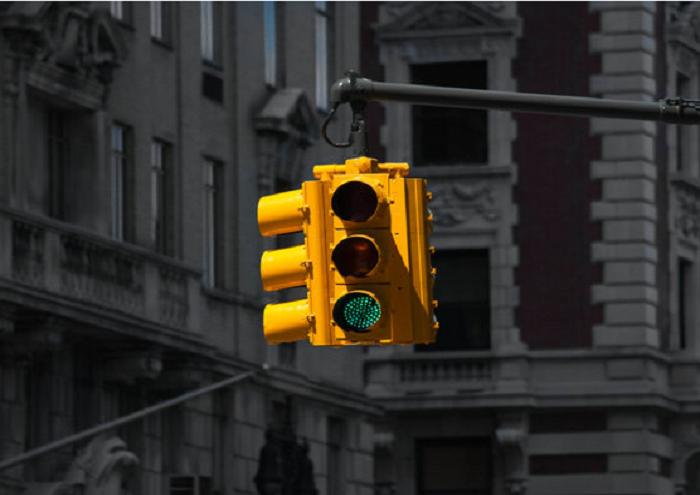
The height and width of the screenshot is (495, 700). What are the coordinates of `windows` in the screenshot? It's located at (318, 68), (270, 57), (204, 34), (155, 32), (119, 13), (120, 173), (152, 182), (211, 227).